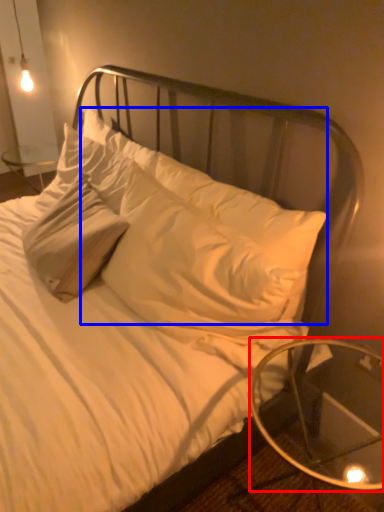
Question: Among these objects, which one is nearest to the camera, table (highlighted by a red box) or pillow (highlighted by a blue box)?

Choices:
 (A) table
 (B) pillow

Answer: (A)